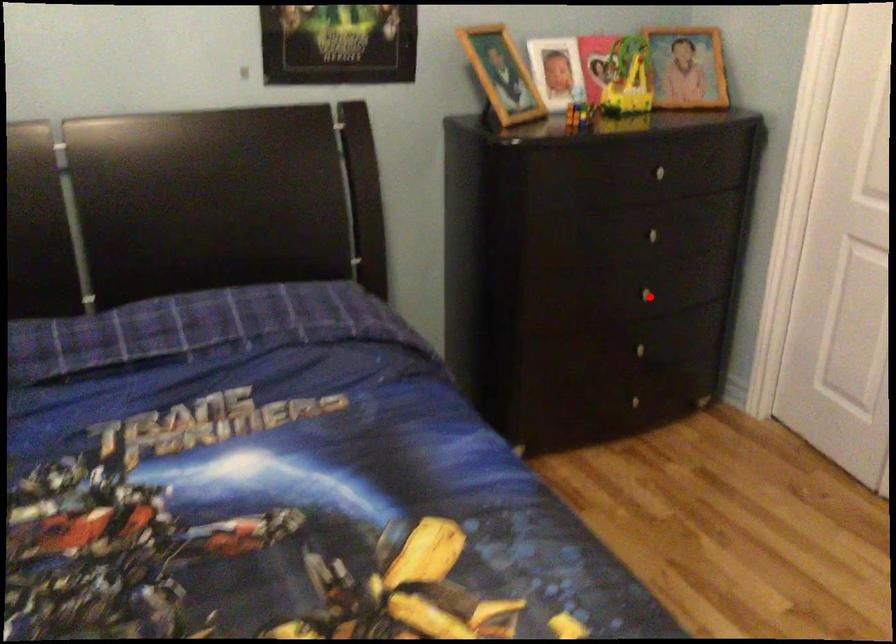
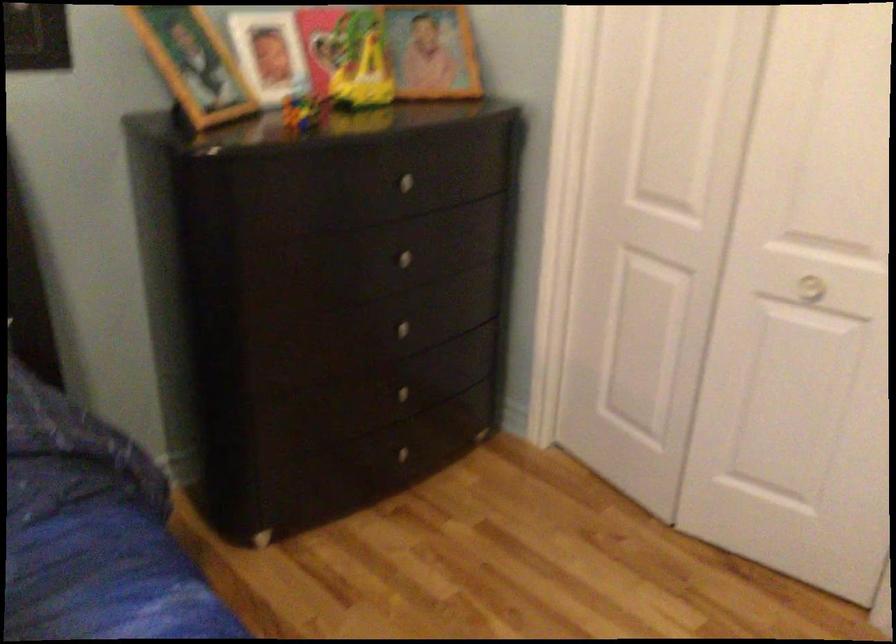
Question: I am providing you with two images of the same scene from different viewpoints. Given a red point in image1, look at the same physical point in image2. Is it:

Choices:
 (A) Closer to the viewpoint
 (B) Farther from the viewpoint

Answer: (A)